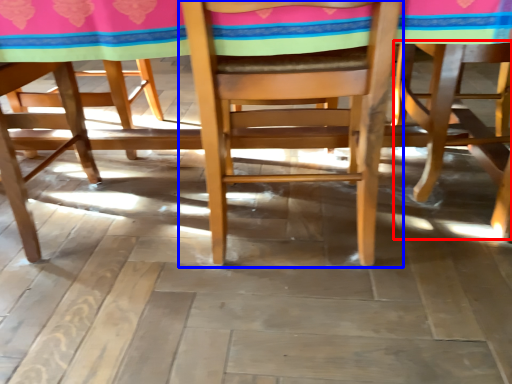
Question: Which of the following is the closest to the observer, chair (highlighted by a red box) or chair (highlighted by a blue box)?

Choices:
 (A) chair
 (B) chair

Answer: (B)